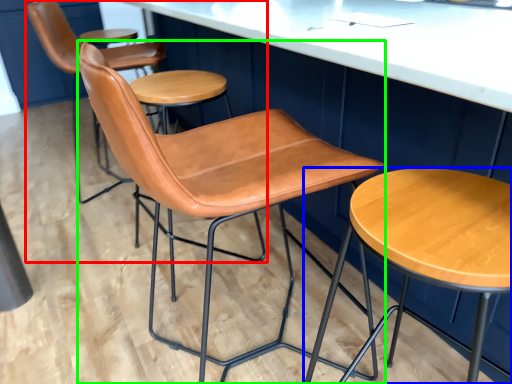
Question: Which object is the closest to the chair (highlighted by a red box)? Choose among these: stool (highlighted by a blue box) or chair (highlighted by a green box).

Choices:
 (A) stool
 (B) chair

Answer: (B)